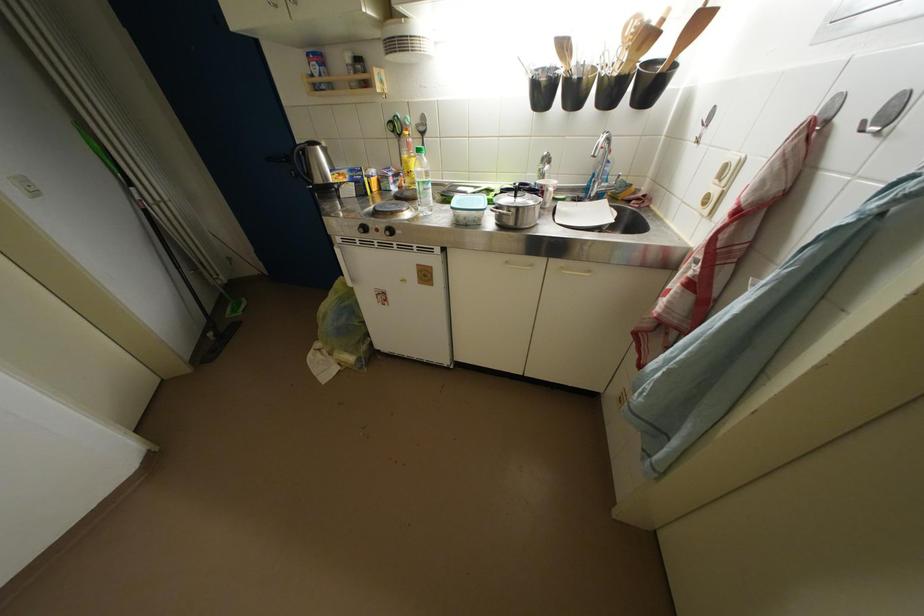
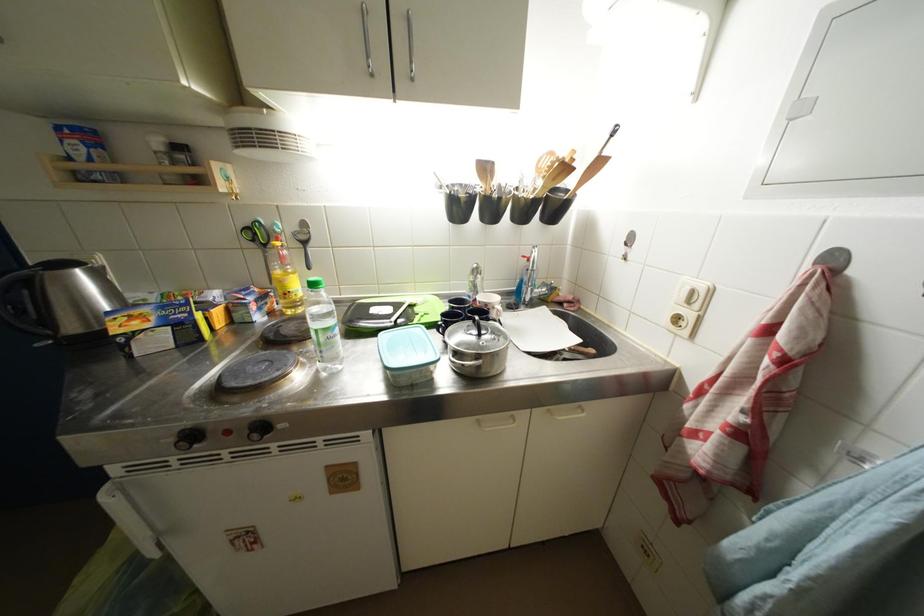
Question: The first image is from the beginning of the video and the second image is from the end. How did the camera likely rotate when shooting the video?

Choices:
 (A) Left
 (B) Right
 (C) Up
 (D) Down

Answer: (B)